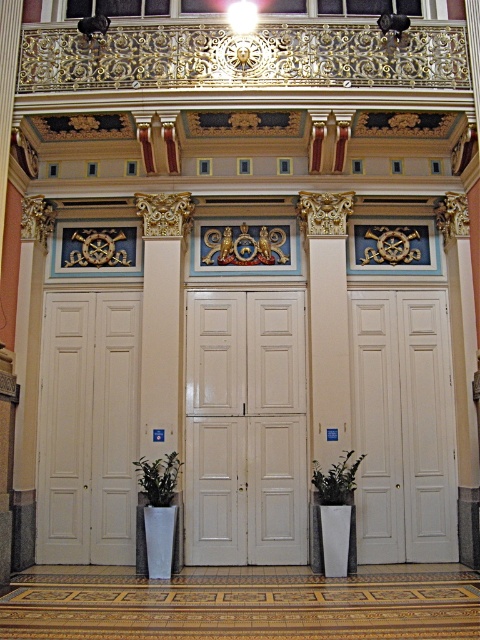
Question: Which object appears farthest from the camera in this image?

Choices:
 (A) white matte door at center
 (B) green leafy plant in white pot at lower left
 (C) green matte plant at center
 (D) white glossy door at center

Answer: (D)

Question: Is white matte door at left below green leafy plant in white pot at lower left?

Choices:
 (A) yes
 (B) no

Answer: (B)

Question: Does green leafy plant in white pot at lower left appear over green matte plant at center?

Choices:
 (A) no
 (B) yes

Answer: (A)

Question: Can you confirm if white matte door at left is positioned to the right of green leafy plant in white pot at lower left?

Choices:
 (A) yes
 (B) no

Answer: (B)

Question: Considering the real-world distances, which object is farthest from the green matte plant at center?

Choices:
 (A) green leafy plant in white pot at lower left
 (B) white glossy door at center
 (C) white matte door at left
 (D) white matte door at center

Answer: (C)

Question: Based on their relative distances, which object is farther from the green leafy plant in white pot at lower left?

Choices:
 (A) green matte plant at center
 (B) white matte door at center
 (C) white matte door at left

Answer: (B)